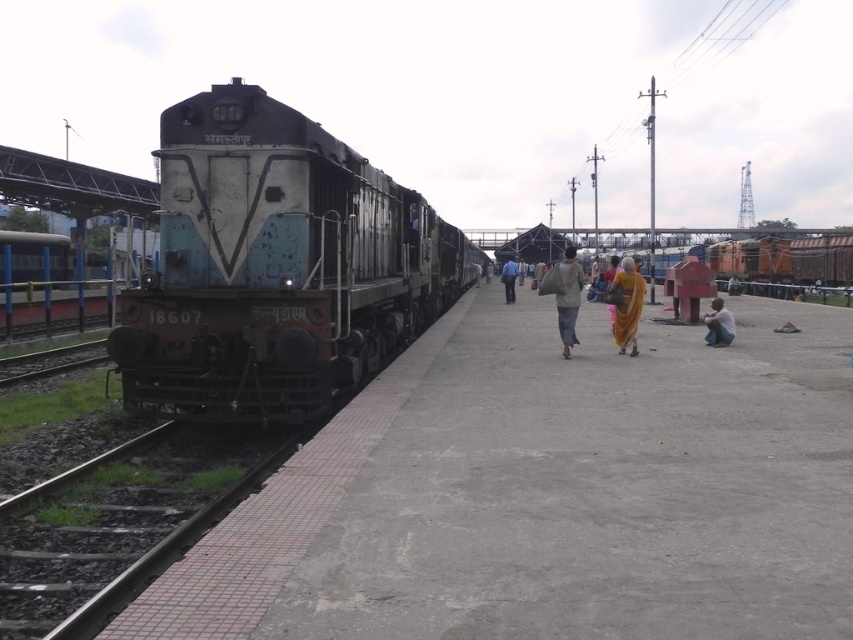
You are a photographer trying to capture both the dirty metal train at center and the matte pink sari at center in a single frame. Based on their sizes, do you think you can fit both in your camera view without zooming in?

The dirty metal train at center might be wider than matte pink sari at center, so there is a possibility that the train could block the sari from being fully visible in the frame if they are positioned side by side.

You are standing on the platform at the railway station and see the metallic blue train at left and the light brown fabric bag at center. Which object is positioned more to the left side?

The metallic blue train at left is positioned more to the left side than the light brown fabric bag at center.